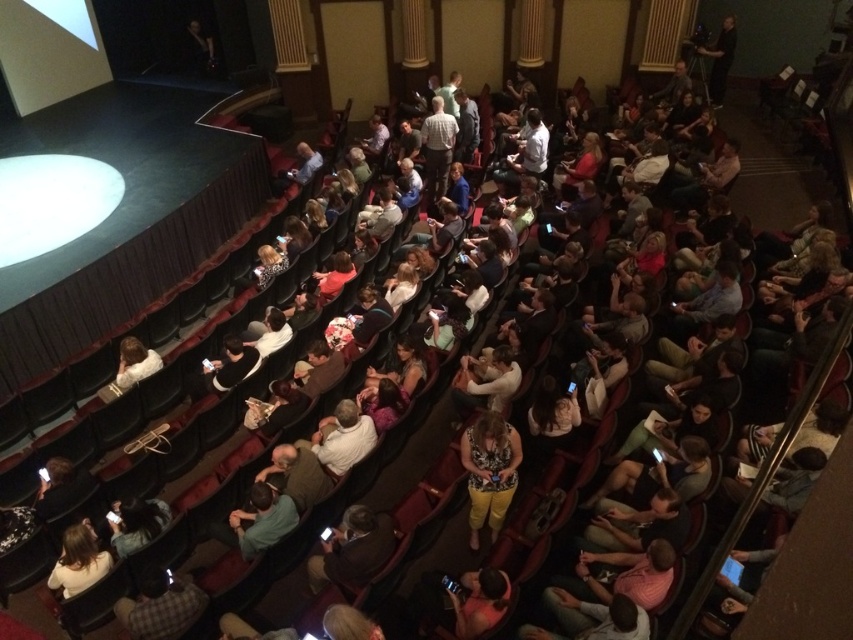
You are sitting in the theater and want to move from your current seat to the exit located at the back of the room. You notice two points marked on the floor. One is at point [485,445] and the other is at point [370,545]. Which point should you walk towards to get to the exit faster?

Answer: Point [485,445] is behind point [370,545], so you should walk towards point [485,445] to reach the exit at the back faster since it is already behind the other point.

You are an event organizer who needs to seat two VIP guests in the front row. The front row has a narrow space between two armrests. The yellow cotton pants at center and dark brown leather jacket at center belong to the guests. Which guest should you seat first to ensure they can comfortably pass through the narrow space?

The yellow cotton pants at center is thinner than the dark brown leather jacket at center, so you should seat the guest wearing the yellow cotton pants at center first to ensure they can comfortably pass through the narrow space between the armrests.